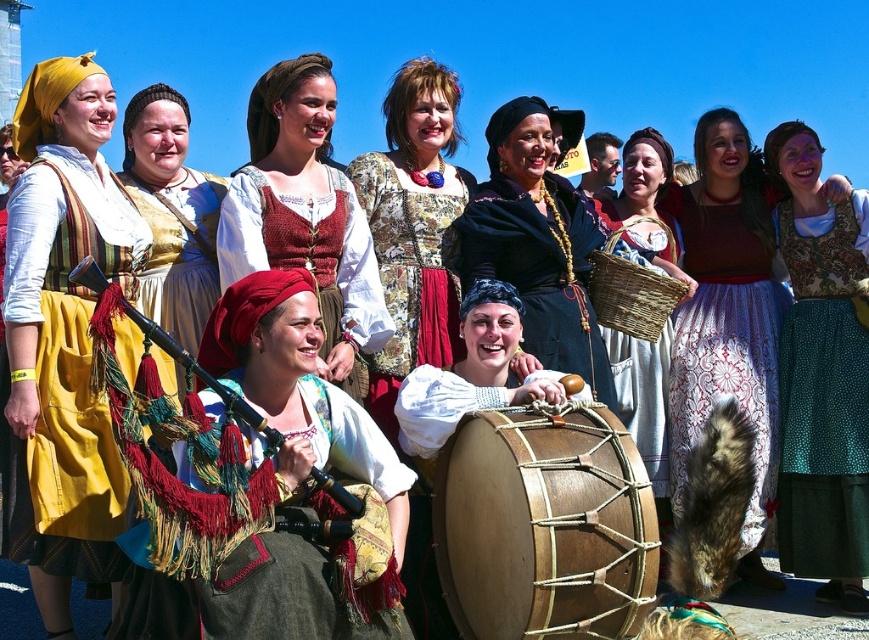
Question: Which point appears farthest from the camera in this image?

Choices:
 (A) (569, 480)
 (B) (428, 141)
 (C) (267, 170)

Answer: (B)

Question: Is dark blue velvet dress at center to the right of matte gold dress at center from the viewer's perspective?

Choices:
 (A) no
 (B) yes

Answer: (B)

Question: Which point is farther to the camera?

Choices:
 (A) embroidered fabric bagpipe at center
 (B) matte yellow skirt at left

Answer: (B)

Question: Can you confirm if knitted red vest at center is thinner than matte wicker basket at center?

Choices:
 (A) yes
 (B) no

Answer: (B)

Question: Is floral-patterned fabric dress at center to the right of dark blue velvet dress at center from the viewer's perspective?

Choices:
 (A) yes
 (B) no

Answer: (B)

Question: Which object is the farthest from the green textured skirt at center?

Choices:
 (A) natural wood drum at center
 (B) floral-patterned fabric dress at center
 (C) matte gold dress at center
 (D) embroidered fabric bagpipe at center

Answer: (C)